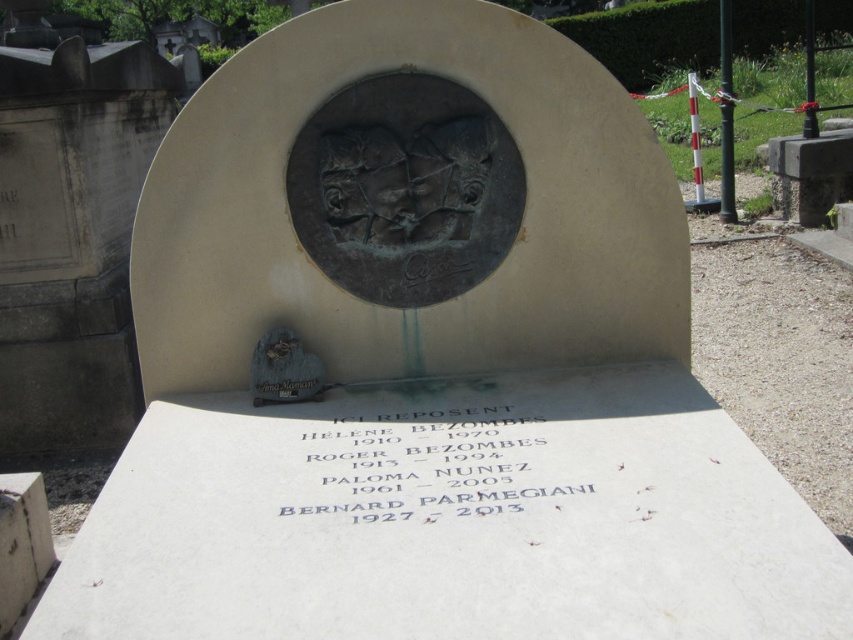
Does point (509, 278) lie behind point (267, 364)?

Yes, it is behind point (267, 364).

Find the location of a particular element. Image resolution: width=853 pixels, height=640 pixels. bronze plaque at center is located at coordinates (436, 305).

Does black stone inscription at center appear under shiny bronze heart at center?

Correct, black stone inscription at center is located below shiny bronze heart at center.

How far apart are black stone inscription at center and shiny bronze heart at center?

The distance of black stone inscription at center from shiny bronze heart at center is 14.16 inches.

Where is `black stone inscription at center`? The width and height of the screenshot is (853, 640). black stone inscription at center is located at coordinates (428, 465).

Which of these two, bronze plaque at center or black stone inscription at center, stands taller?

bronze plaque at center is taller.

Between bronze plaque at center and black stone inscription at center, which one appears on the right side from the viewer's perspective?

Positioned to the right is black stone inscription at center.

Which is behind, point (608, 262) or point (480, 472)?

Point (608, 262)

The width and height of the screenshot is (853, 640). Identify the location of bronze plaque at center. (436, 305).